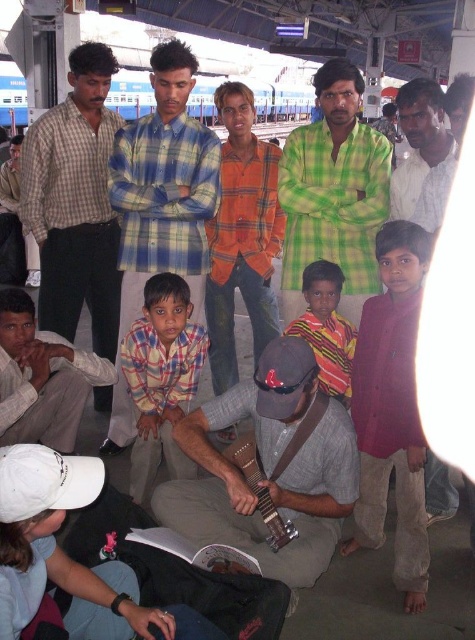
You are standing at the center of the platform and want to find the red shirt at right. In which direction should you look to locate it?

You should look to your right to locate the red shirt at right since it is positioned at the right side of the scene.

You are a photographer trying to capture a group photo of the blue plaid shirt at center and the green plaid shirt at center. If you want to ensure both are fully visible in the frame, which person should you position closer to the camera?

The blue plaid shirt at center might be wider than green plaid shirt at center, so you should position the blue plaid shirt at center closer to the camera to ensure both are fully visible in the frame.